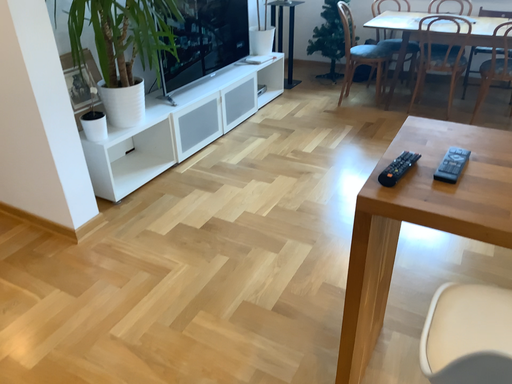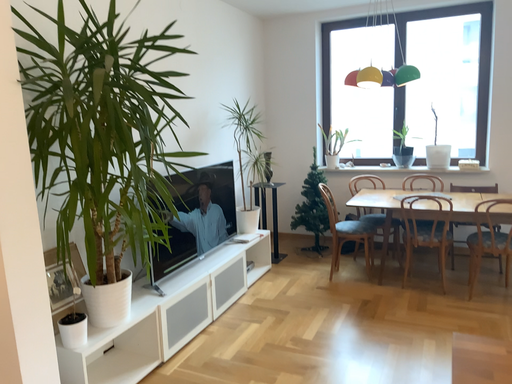
Question: How did the camera likely rotate when shooting the video?

Choices:
 (A) rotated upward
 (B) rotated downward

Answer: (A)